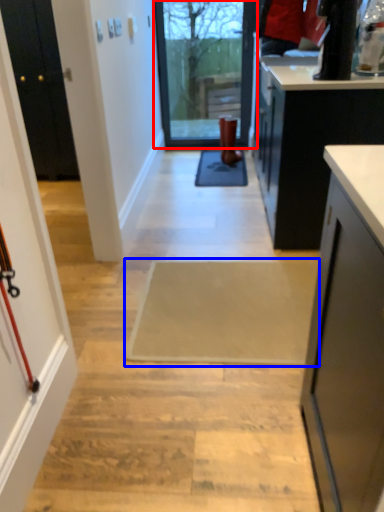
Question: Among these objects, which one is farthest to the camera, glass door (highlighted by a red box) or doormat (highlighted by a blue box)?

Choices:
 (A) glass door
 (B) doormat

Answer: (A)